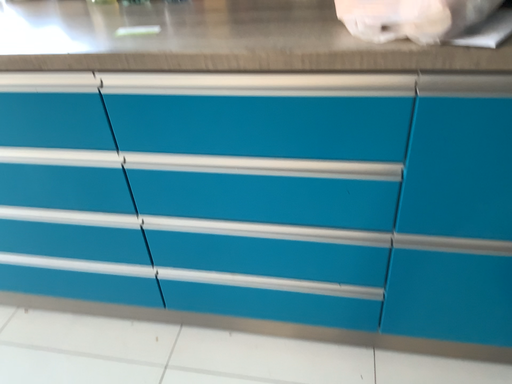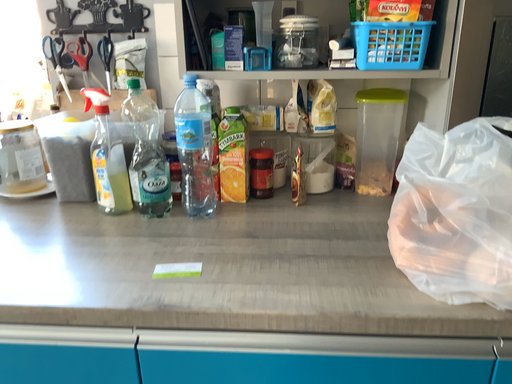
Question: Which way did the camera rotate in the video?

Choices:
 (A) rotated downward
 (B) rotated upward

Answer: (B)